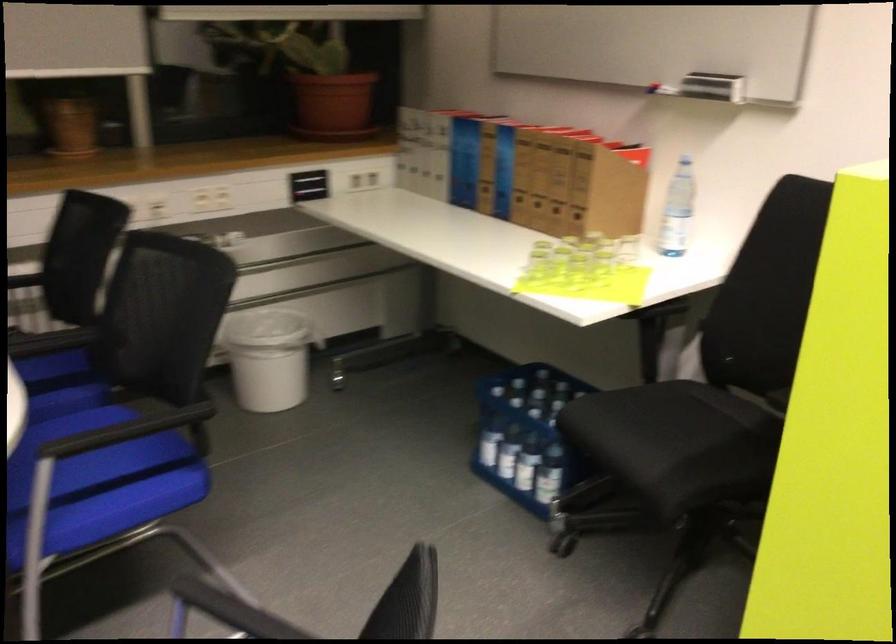
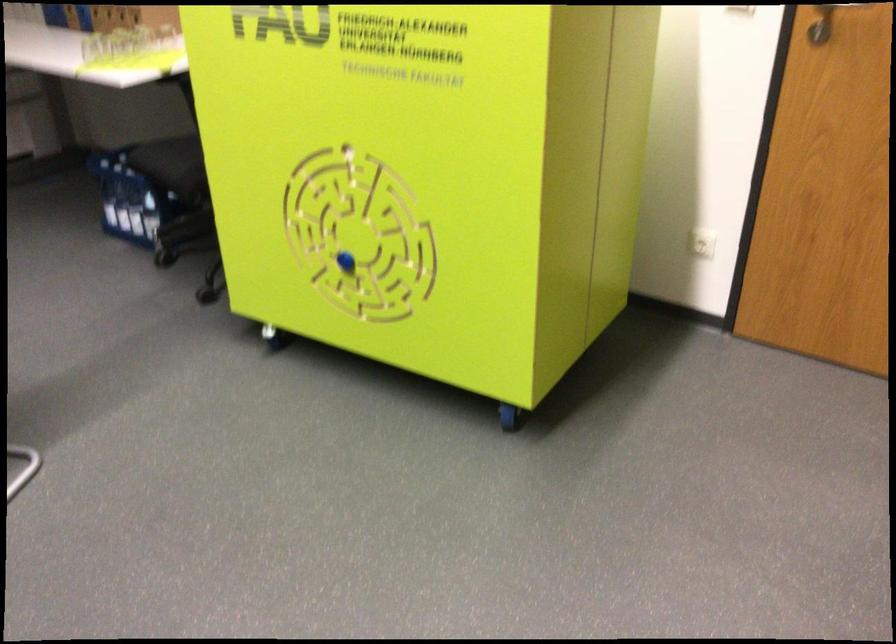
Question: I am providing you with two images of the same scene from different viewpoints. Which of the following objects are not visible in image2?

Choices:
 (A) blue plastic crate
 (B) wall power outlet
 (C) blue maze knob
 (D) none of these

Answer: (D)